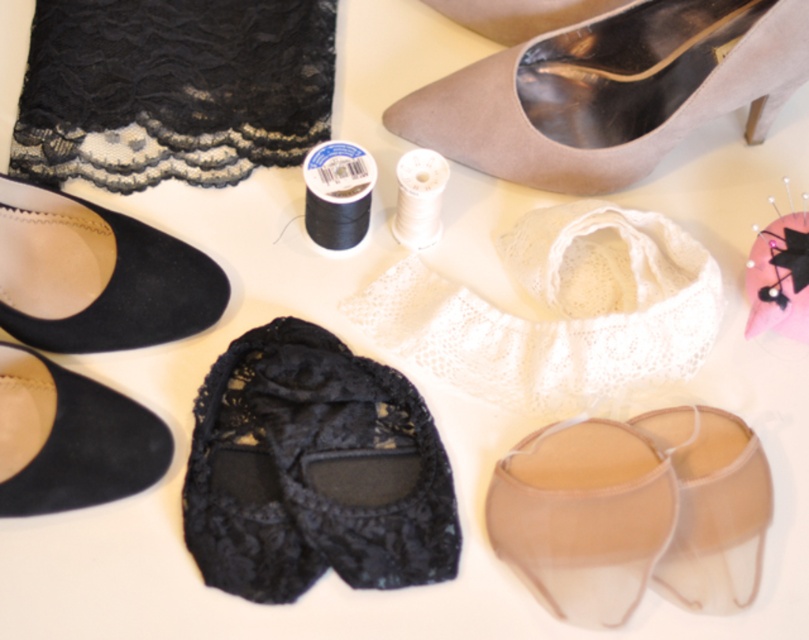
You are organizing a craft station and need to place a new item between the suede black shoe at lower left and the translucent beige sandal at lower right. Based on their positions, which shoe should the new item be placed closer to?

The new item should be placed closer to the suede black shoe at lower left because it is closer to the viewer than the translucent beige sandal at lower right.

You are organizing a craft fair booth and need to arrange items by height. You have a black lace slipper at center and a suede black shoe at lower left. Which item should be placed in the taller section of your display?

The black lace slipper at center should be placed in the taller section because it has a greater height compared to the suede black shoe at lower left.

You are organizing a craft display and need to place the suede black shoe at lower left and the translucent beige sandal at lower right. According to their positions, which item is positioned more to the left?

The suede black shoe at lower left is positioned more to the left than the translucent beige sandal at lower right.